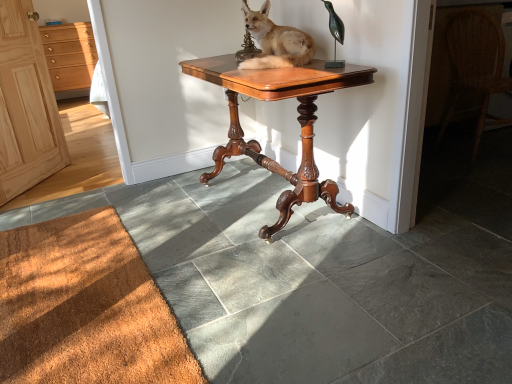
What are the coordinates of `vacant space to the right of natural wood cabinet at left` in the screenshot? It's located at (78, 178).